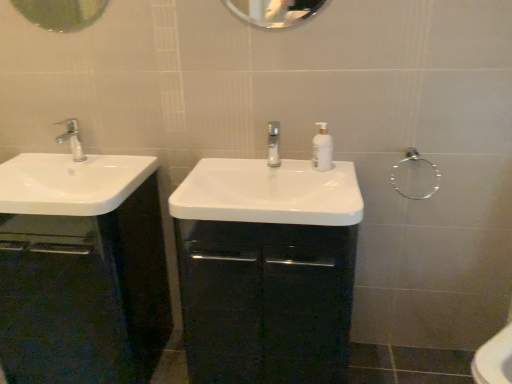
I want to click on vacant area that lies to the right of silver metallic faucet at left, the second tap when ordered from right to left, so click(99, 175).